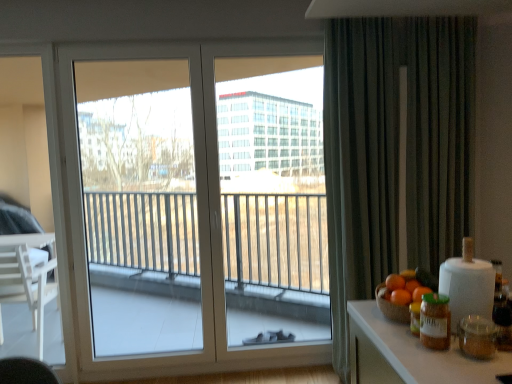
What are the coordinates of `vacant point above dark grey textured curtain at right (from a real-world perspective)` in the screenshot? It's located at (397, 5).